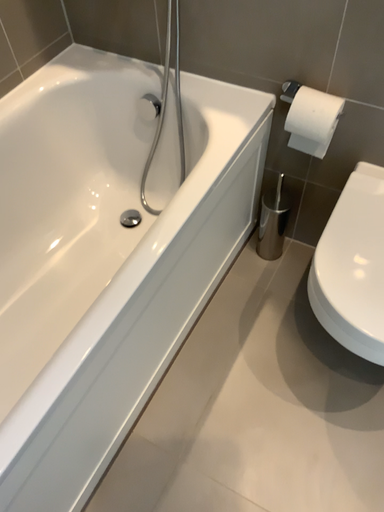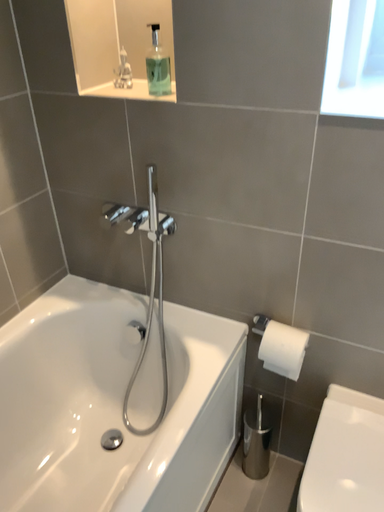
Question: Which way did the camera rotate in the video?

Choices:
 (A) rotated upward
 (B) rotated downward

Answer: (A)